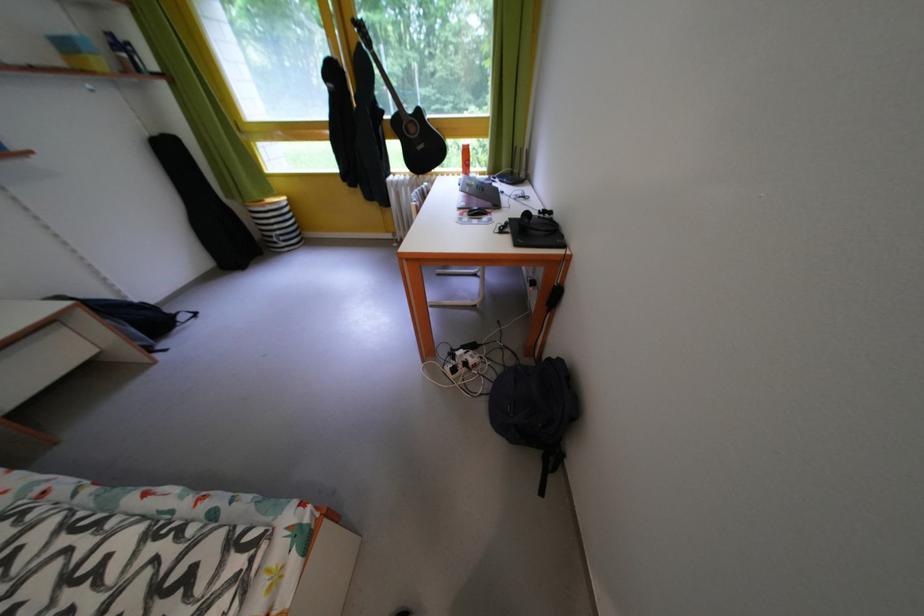
Identify the location of black bag. This screenshot has width=924, height=616. (535, 408).